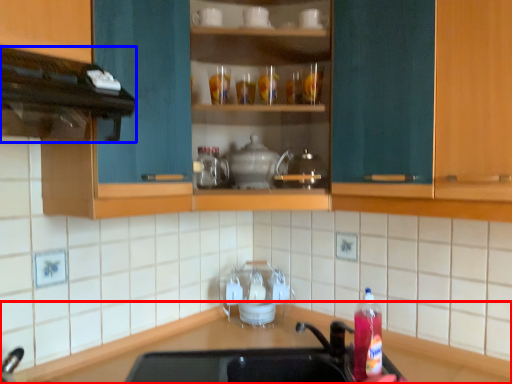
Question: Which of the following is the farthest to the observer, countertop (highlighted by a red box) or vent (highlighted by a blue box)?

Choices:
 (A) countertop
 (B) vent

Answer: (B)